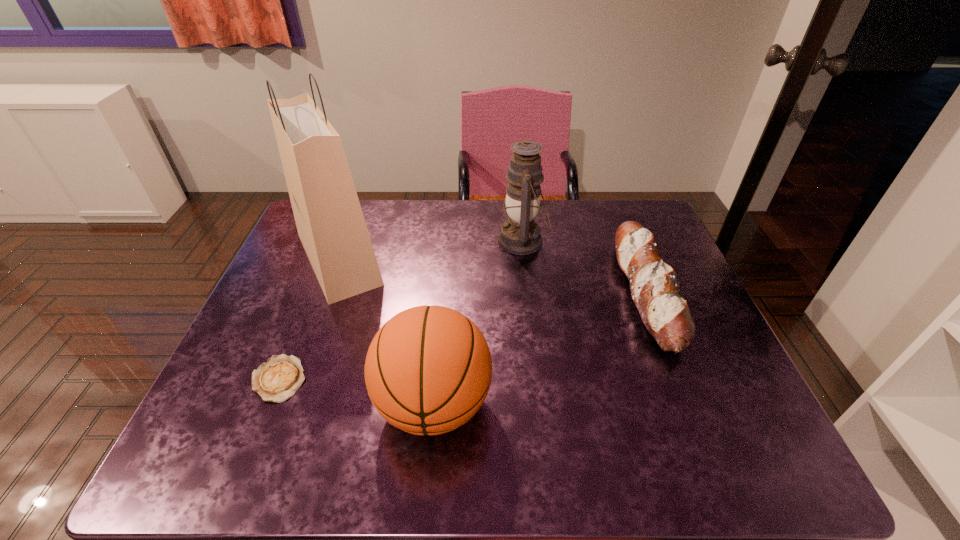
Where is `free space located 0.170m on the left of the basketball`? This screenshot has height=540, width=960. free space located 0.170m on the left of the basketball is located at coordinates (295, 403).

Locate an element on the screen. vacant space located 0.270m on the left of the second shortest object is located at coordinates (519, 293).

Identify the location of vacant space situated 0.140m on the right of the quiche. (371, 379).

This screenshot has width=960, height=540. I want to click on shopping bag that is at the far edge, so click(x=330, y=223).

What are the coordinates of `oil lamp that is at the far edge` in the screenshot? It's located at (520, 234).

Where is `baguet that is at the far edge`? baguet that is at the far edge is located at coordinates (654, 289).

Find the location of a particular element. Image resolution: width=960 pixels, height=540 pixels. object at the near edge is located at coordinates [x=428, y=370].

The image size is (960, 540). I want to click on shopping bag at the left edge, so click(330, 223).

Identify the location of quiche situated at the left edge. (277, 380).

This screenshot has height=540, width=960. What are the coordinates of `object that is positioned at the right edge` in the screenshot? It's located at (654, 289).